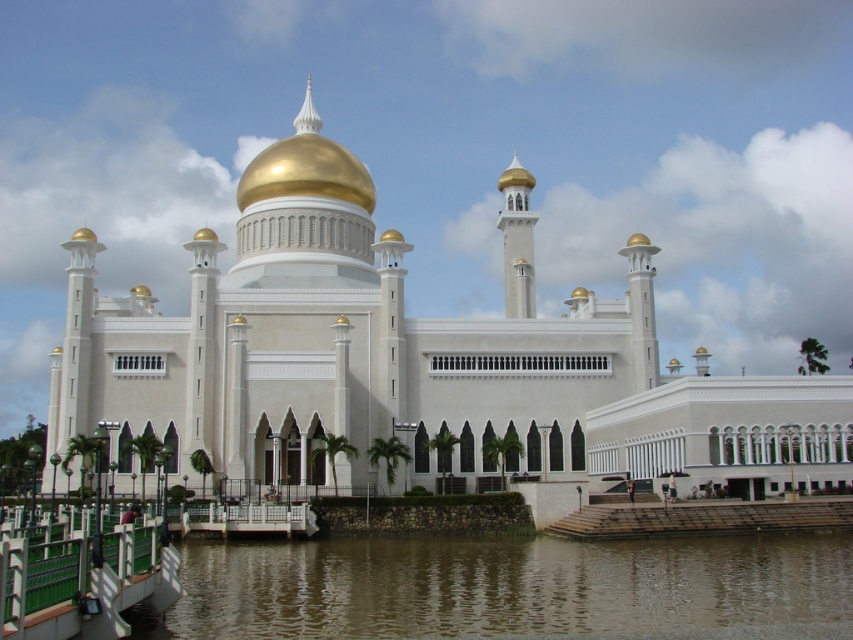
Between white marble mosque at center and brown murky water at lower center, which one has more height?

Standing taller between the two is white marble mosque at center.

Measure the distance between white marble mosque at center and brown murky water at lower center.

22.13 meters

Who is more forward, (460,436) or (339,547)?

Point (339,547) is in front.

Locate an element on the screen. This screenshot has width=853, height=640. white marble mosque at center is located at coordinates pyautogui.click(x=415, y=362).